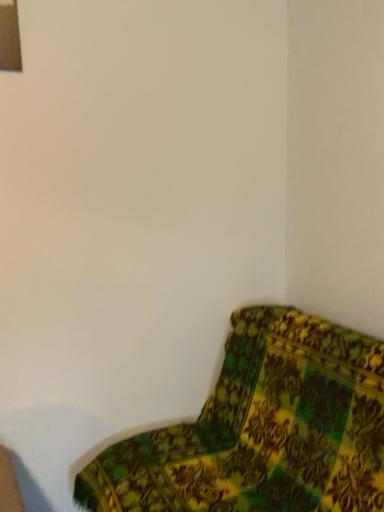
The width and height of the screenshot is (384, 512). What do you see at coordinates (263, 429) in the screenshot?
I see `green patterned fabric at lower right` at bounding box center [263, 429].

You are a GUI agent. You are given a task and a screenshot of the screen. Output one action in this format:
    pyautogui.click(x=<x>, y=<y>)
    Task: Click on the green patterned fabric at lower right
    This screenshot has height=512, width=384.
    Given the screenshot: What is the action you would take?
    pyautogui.click(x=263, y=429)

I want to click on green patterned fabric at lower right, so click(263, 429).